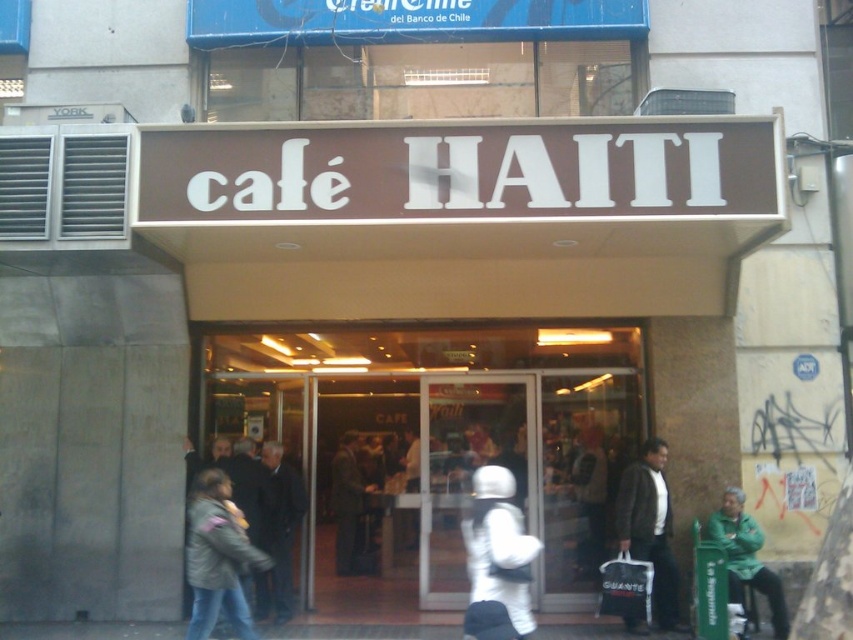
You are standing at the entrance of the cafe and want to place a new menu board. The menu board must be placed to the right of the white matte astronaut suit at center. Where should you place the menu board?

The menu board should be placed to the right of the white matte astronaut suit at center, which is located at point (x=497, y=560). Since the astronaut suit is at the center, placing the menu board to its right would mean positioning it towards the right side of the cafe entrance.

You are standing outside the entrance of the cafe and want to enter. You see the transparent glass door at center and the black leather coat at center. Which object is closer to you?

The transparent glass door at center is closer to you since it is further to the viewer than the black leather coat at center.